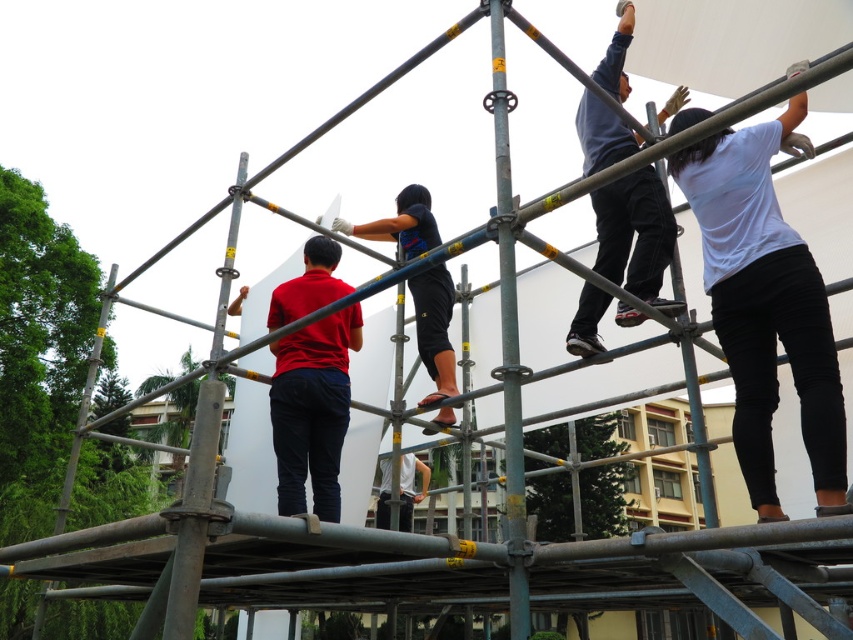
You are a safety inspector observing the construction site. You notice two workers wearing dark blue jeans at upper right and dark blue fabric shirt at center. Which worker is at a higher elevation?

The dark blue jeans at upper right is much taller as dark blue fabric shirt at center, so the worker wearing dark blue jeans at upper right is at a higher elevation.

Based on the photo, you are a safety inspector assessing the distance between the workers for proper safety protocols. The minimum safe distance between workers on scaffolding is 6 feet. Are the workers wearing the white matte shirt at upper right and the dark blue fabric shirt at center maintaining the required distance?

The white matte shirt at upper right is 5.60 feet from the dark blue fabric shirt at center. Since 5.60 feet is less than the required 6 feet, the workers are not maintaining the proper safety distance.